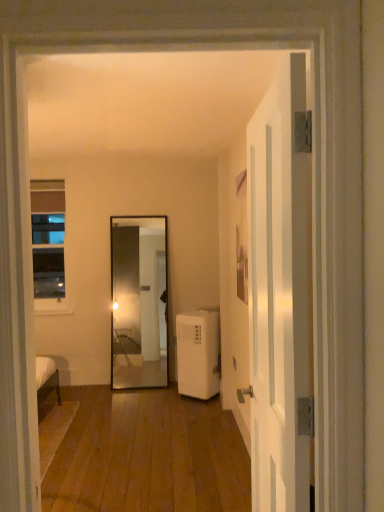
Where is `blank area to the left of white plastic air conditioner at lower right`? This screenshot has height=512, width=384. blank area to the left of white plastic air conditioner at lower right is located at coordinates (145, 389).